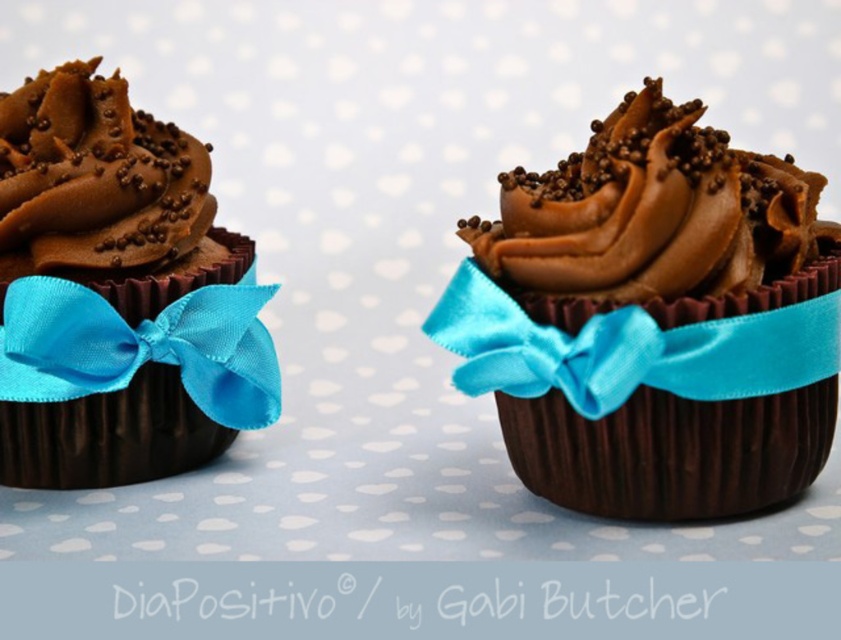
Question: Which object appears farthest from the camera in this image?

Choices:
 (A) turquoise satin ribbon at left
 (B) chocolate matte ribbon at left

Answer: (B)

Question: Is chocolate matte ribbon at left positioned before chocolatesmoothcupcake at right?

Choices:
 (A) yes
 (B) no

Answer: (B)

Question: Which point is farther to the camera?

Choices:
 (A) chocolatesmoothcupcake at left
 (B) matte chocolate cupcake at center
 (C) chocolate matte ribbon at left
 (D) turquoise satin ribbon at left

Answer: (A)

Question: Among these points, which one is farthest from the camera?

Choices:
 (A) (812, 172)
 (B) (36, 154)
 (C) (569, 192)

Answer: (B)

Question: Is chocolatesmoothcupcake at left wider than turquoise satin ribbon at right?

Choices:
 (A) yes
 (B) no

Answer: (B)

Question: Considering the relative positions of chocolate matte ribbon at left and turquoise satin ribbon at right in the image provided, where is chocolate matte ribbon at left located with respect to turquoise satin ribbon at right?

Choices:
 (A) above
 (B) below

Answer: (A)